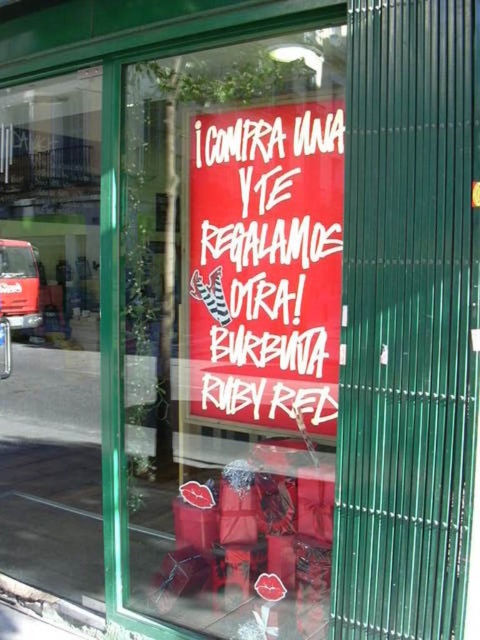
Looking at this image, who is more forward, (273,189) or (288,330)?

Point (273,189) is more forward.

Who is positioned more to the left, red paper sign at center or matte red sign at center?

red paper sign at center

Describe the element at coordinates (233, 332) in the screenshot. The width and height of the screenshot is (480, 640). I see `red paper sign at center` at that location.

Locate an element on the screen. The image size is (480, 640). red paper sign at center is located at coordinates [x=233, y=332].

Between transparent glass window at left and matte red sign at center, which one appears on the left side from the viewer's perspective?

From the viewer's perspective, transparent glass window at left appears more on the left side.

Who is positioned more to the right, transparent glass window at left or matte red sign at center?

From the viewer's perspective, matte red sign at center appears more on the right side.

Is point (99, 150) less distant than point (206, 372)?

That is False.

You are a GUI agent. You are given a task and a screenshot of the screen. Output one action in this format:
    pyautogui.click(x=<x>, y=<y>)
    Task: Click on the transparent glass window at left
    The width and height of the screenshot is (480, 640).
    Given the screenshot: What is the action you would take?
    pyautogui.click(x=51, y=337)

Is red paper sign at center below transparent glass window at left?

Yes, red paper sign at center is below transparent glass window at left.

Is point (312, 620) positioned behind point (70, 320)?

No, (312, 620) is in front of (70, 320).

What do you see at coordinates (233, 332) in the screenshot?
I see `red paper sign at center` at bounding box center [233, 332].

At what (x,y) coordinates should I click in order to perform the action: click on red paper sign at center. Please return your answer as a coordinate pair (x, y). Looking at the image, I should click on (233, 332).